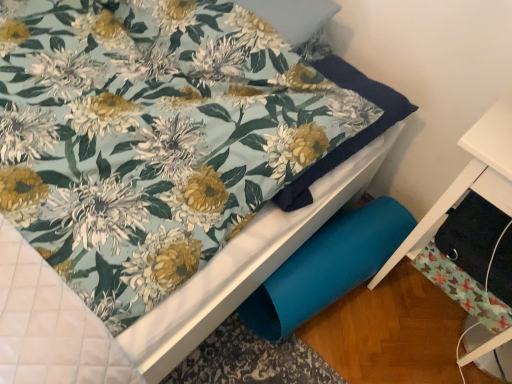
Where is `black fabric drawer at lower right`? The image size is (512, 384). black fabric drawer at lower right is located at coordinates (472, 175).

What do you see at coordinates (472, 175) in the screenshot? This screenshot has width=512, height=384. I see `black fabric drawer at lower right` at bounding box center [472, 175].

Describe the element at coordinates (471, 235) in the screenshot. I see `black fabric drawer at lower right` at that location.

You are a GUI agent. You are given a task and a screenshot of the screen. Output one action in this format:
    pyautogui.click(x=<x>, y=<y>)
    Task: Click on the black fabric drawer at lower right
    
    Given the screenshot: What is the action you would take?
    pyautogui.click(x=471, y=235)

Locate an element on the screen. This screenshot has width=512, height=384. black fabric drawer at lower right is located at coordinates coord(472,175).

Is black fabric drawer at lower right to the right of black fabric drawer at lower right from the viewer's perspective?

Incorrect, black fabric drawer at lower right is not on the right side of black fabric drawer at lower right.

In the scene shown: Which object is further away from the camera taking this photo, black fabric drawer at lower right or black fabric drawer at lower right?

black fabric drawer at lower right is further away from the camera.

Does point (501, 282) lie behind point (437, 200)?

No.

From the image's perspective, is black fabric drawer at lower right located above black fabric drawer at lower right?

Correct, black fabric drawer at lower right appears higher than black fabric drawer at lower right in the image.

From a real-world perspective, which object stands above the other?

black fabric drawer at lower right.

Which of these two, black fabric drawer at lower right or black fabric drawer at lower right, is thinner?

black fabric drawer at lower right.

Which of these two, black fabric drawer at lower right or black fabric drawer at lower right, stands taller?

black fabric drawer at lower right.

Who is smaller, black fabric drawer at lower right or black fabric drawer at lower right?

black fabric drawer at lower right is smaller.

Would you say black fabric drawer at lower right is part of black fabric drawer at lower right's contents?

No, black fabric drawer at lower right is not inside black fabric drawer at lower right.

Is black fabric drawer at lower right not close to black fabric drawer at lower right?

That's not correct — black fabric drawer at lower right is a little close to black fabric drawer at lower right.

Is black fabric drawer at lower right at the back of black fabric drawer at lower right?

Correct, black fabric drawer at lower right is looking away from black fabric drawer at lower right.

Can you tell me how much black fabric drawer at lower right and black fabric drawer at lower right differ in facing direction?

They differ by 0.971 degrees in their facing directions.

This screenshot has height=384, width=512. What are the coordinates of `drawer above the black fabric drawer at lower right (from a real-world perspective)` in the screenshot? It's located at (471, 235).

Considering the relative positions of black fabric drawer at lower right and black fabric drawer at lower right in the image provided, is black fabric drawer at lower right to the left of black fabric drawer at lower right from the viewer's perspective?

Incorrect, black fabric drawer at lower right is not on the left side of black fabric drawer at lower right.

Relative to black fabric drawer at lower right, is black fabric drawer at lower right in front or behind?

Clearly, black fabric drawer at lower right is in front of black fabric drawer at lower right.

Considering the points (505, 174) and (498, 227), which point is in front, point (505, 174) or point (498, 227)?

Point (505, 174)

From the image's perspective, would you say black fabric drawer at lower right is shown under black fabric drawer at lower right?

Yes, from the image's perspective, black fabric drawer at lower right is below black fabric drawer at lower right.

From a real-world perspective, is black fabric drawer at lower right positioned above or below black fabric drawer at lower right?

From a real-world perspective, black fabric drawer at lower right is physically below black fabric drawer at lower right.

Looking at this image, considering the relative sizes of black fabric drawer at lower right and black fabric drawer at lower right in the image provided, is black fabric drawer at lower right thinner than black fabric drawer at lower right?

In fact, black fabric drawer at lower right might be wider than black fabric drawer at lower right.

Is black fabric drawer at lower right taller or shorter than black fabric drawer at lower right?

Clearly, black fabric drawer at lower right is taller compared to black fabric drawer at lower right.

Looking at the image, does black fabric drawer at lower right seem bigger or smaller compared to black fabric drawer at lower right?

In the image, black fabric drawer at lower right appears to be larger than black fabric drawer at lower right.

Is black fabric drawer at lower right a part of black fabric drawer at lower right?

Yes.

From the picture: Is black fabric drawer at lower right not close to black fabric drawer at lower right?

No, black fabric drawer at lower right is not far away from black fabric drawer at lower right.

Is black fabric drawer at lower right facing towards black fabric drawer at lower right?

Yes.

What's the angular difference between black fabric drawer at lower right and black fabric drawer at lower right's facing directions?

0.971 degrees separate the facing orientations of black fabric drawer at lower right and black fabric drawer at lower right.

The image size is (512, 384). What are the coordinates of `furniture below the black fabric drawer at lower right (from the image's perspective)` in the screenshot? It's located at click(472, 175).

Find the location of a particular element. Image resolution: width=512 pixels, height=384 pixels. furniture on the right of black fabric drawer at lower right is located at coordinates (472, 175).

Identify the location of furniture located in front of the black fabric drawer at lower right. (472, 175).